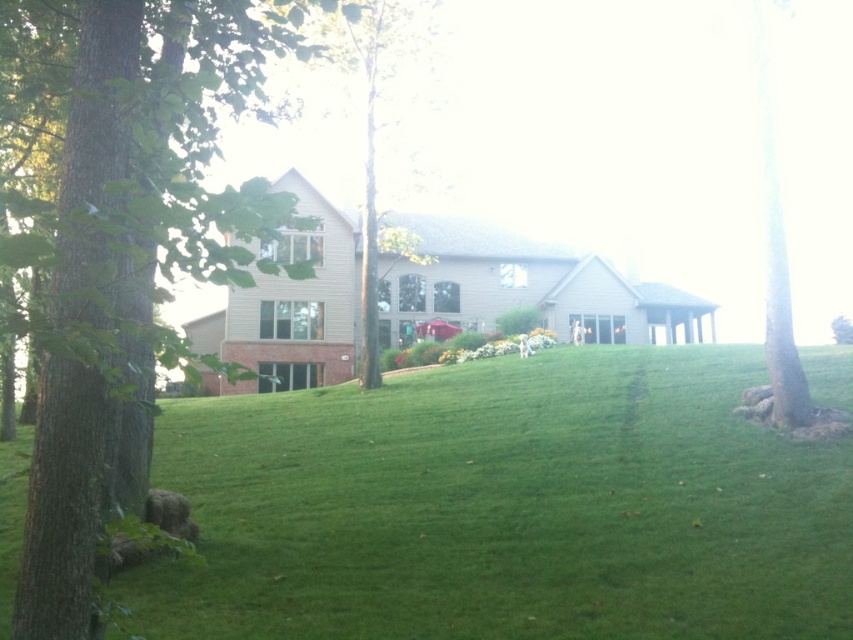
Is green leafy tree at center positioned behind green leafy tree at right?

No, green leafy tree at center is closer to the viewer.

This screenshot has height=640, width=853. What do you see at coordinates (376, 122) in the screenshot? I see `green leafy tree at center` at bounding box center [376, 122].

The height and width of the screenshot is (640, 853). What are the coordinates of `green leafy tree at center` in the screenshot? It's located at (376, 122).

Looking at this image, is brown rough bark tree at right closer to the viewer compared to green leafy tree at right?

Yes, it is.

Is point (764, 67) behind point (831, 320)?

That is False.

You are a GUI agent. You are given a task and a screenshot of the screen. Output one action in this format:
    pyautogui.click(x=<x>, y=<y>)
    Task: Click on the brown rough bark tree at right
    
    Given the screenshot: What is the action you would take?
    pyautogui.click(x=775, y=253)

Does brown rough tree at left lie in front of brown rough bark tree at right?

That is True.

Between point (314, 260) and point (786, 275), which one is positioned in front?

Positioned in front is point (314, 260).

Image resolution: width=853 pixels, height=640 pixels. Identify the location of brown rough tree at left. (131, 253).